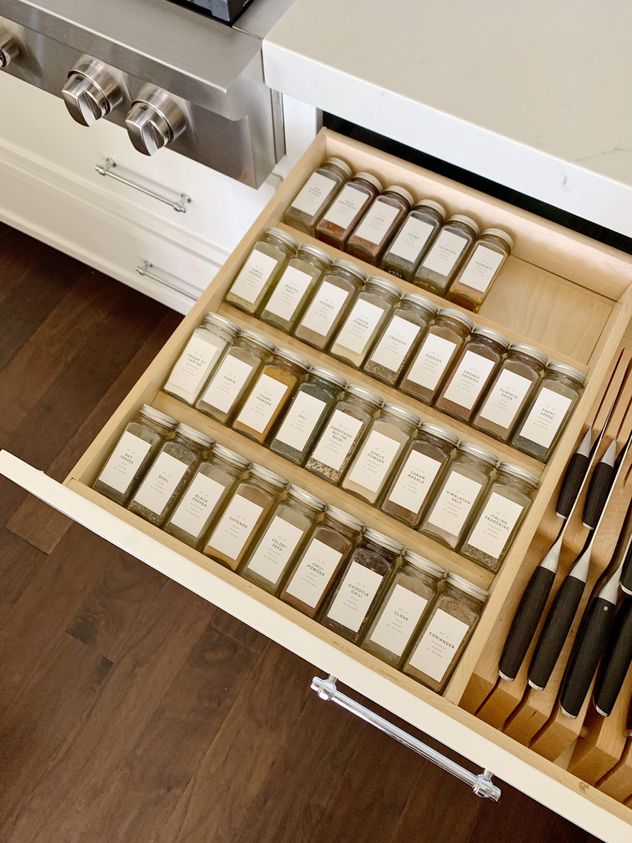
The height and width of the screenshot is (843, 632). I want to click on drawers, so click(x=75, y=180), click(x=106, y=250).